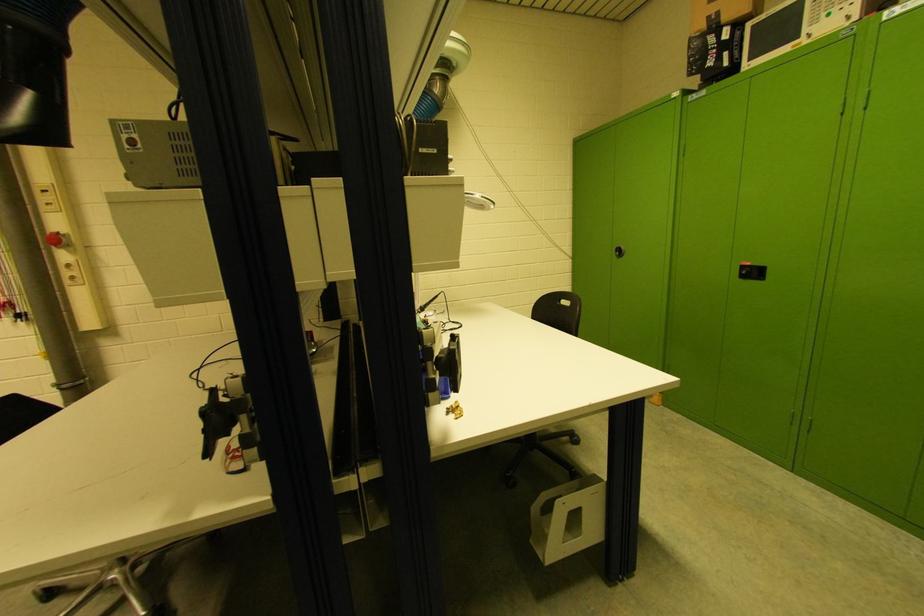
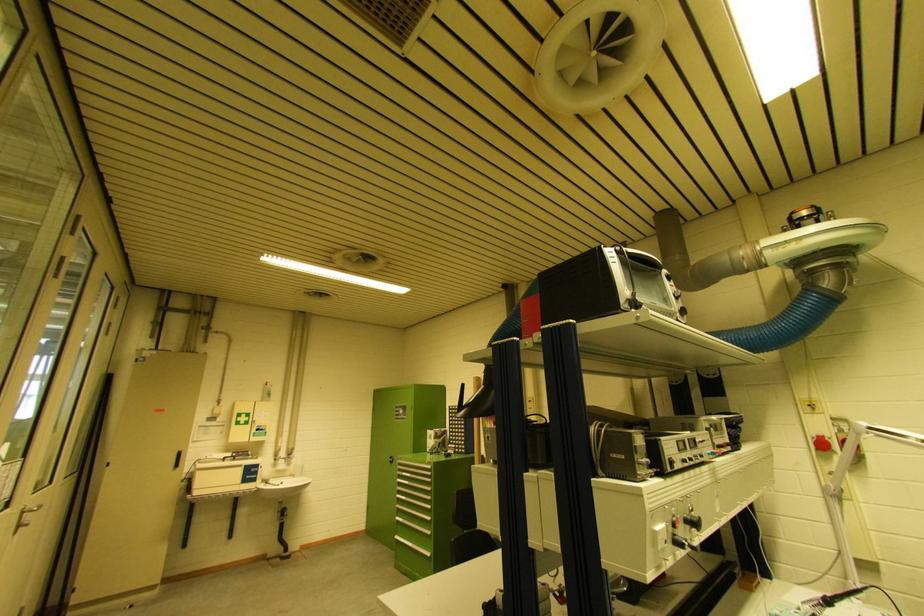
The first image is from the beginning of the video and the second image is from the end. How did the camera likely rotate when shooting the video?

The rotation direction of the camera is left-up.